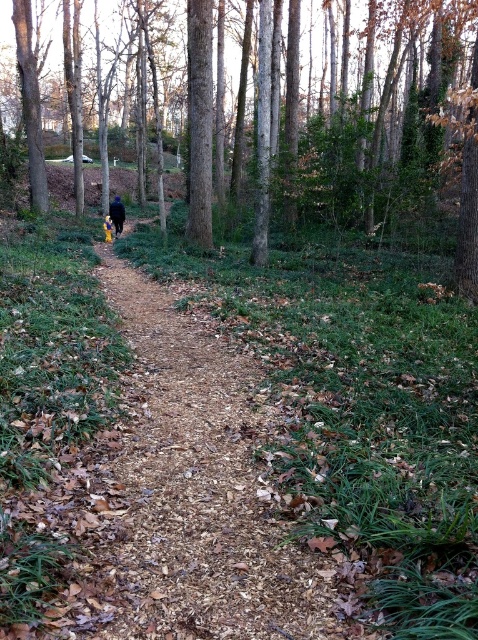
Is brown smooth tree at center smaller than yellow fabric at center?

Incorrect, brown smooth tree at center is not smaller in size than yellow fabric at center.

Consider the image. Can you confirm if brown smooth tree at center is wider than yellow fabric at center?

Indeed, brown smooth tree at center has a greater width compared to yellow fabric at center.

Is point (257, 193) farther from viewer compared to point (117, 218)?

No.

Where is `brown smooth tree at center`? The height and width of the screenshot is (640, 478). brown smooth tree at center is located at coordinates (403, 116).